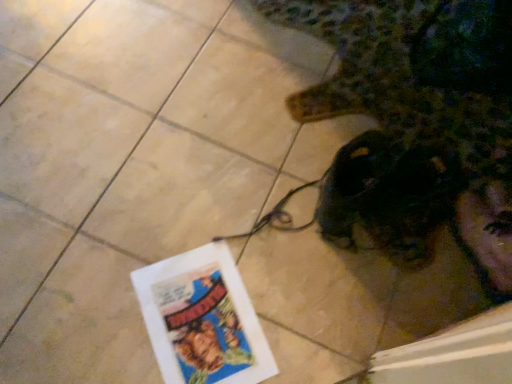
Locate an element on the screen. The image size is (512, 384). vacant space to the right of shiny black headphones at lower right is located at coordinates (457, 229).